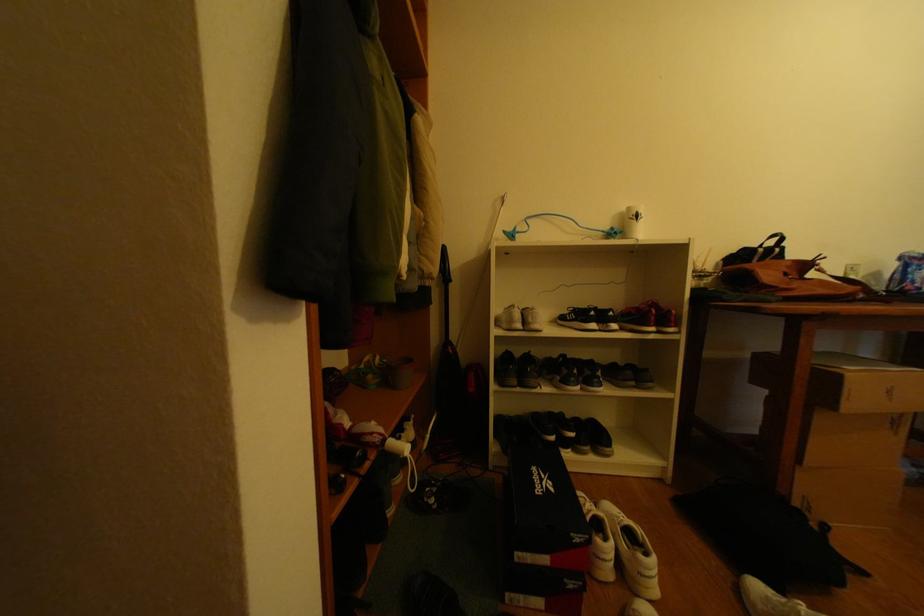
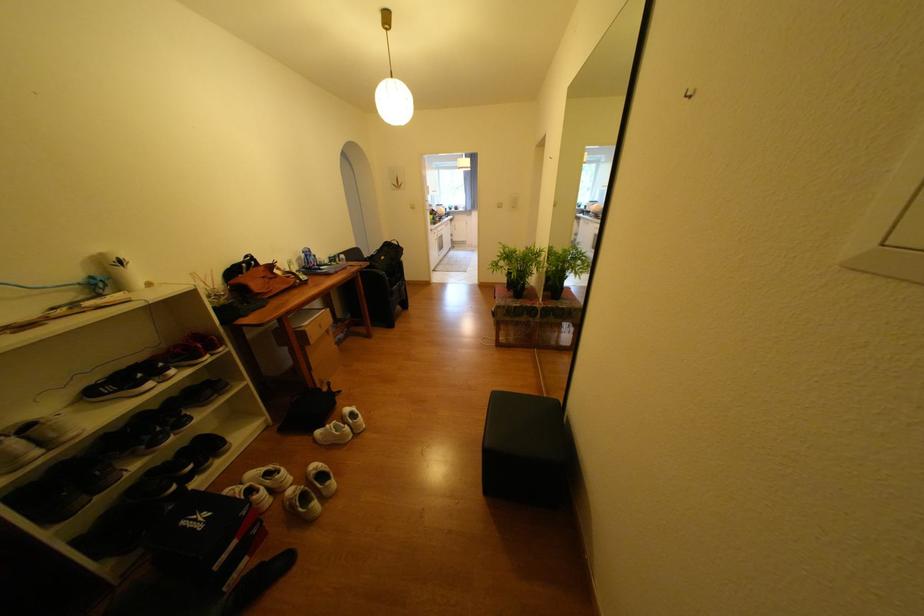
The point at (608, 525) is marked in the first image. Where is the corresponding point in the second image?

(259, 492)